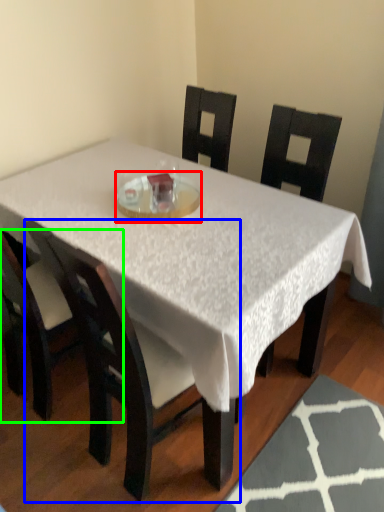
Question: Based on their relative distances, which object is farther from glass plate (highlighted by a red box)? Choose from chair (highlighted by a blue box) and chair (highlighted by a green box).

Choices:
 (A) chair
 (B) chair

Answer: (B)